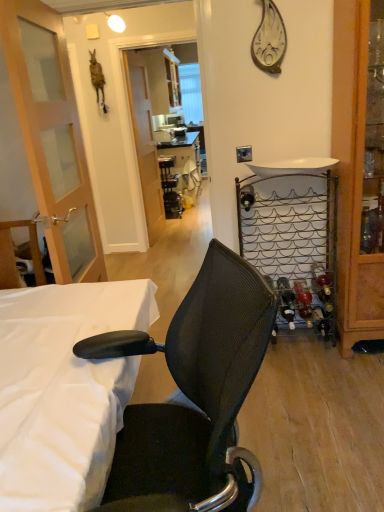
Question: Is point (340, 18) positioned closer to the camera than point (281, 162)?

Choices:
 (A) closer
 (B) farther

Answer: (A)

Question: Which is correct: wooden cabinet at right is inside white glossy sink at upper right, or outside of it?

Choices:
 (A) inside
 (B) outside

Answer: (B)

Question: Based on their relative distances, which object is nearer to the transparent glass screen door at center?

Choices:
 (A) black plastic table at center
 (B) metallic wire wine rack at right, the first bed positioned from the back
 (C) wooden cabinet at right
 (D) metallic leaf-shaped clock at upper right
 (E) black mesh office chair at center

Answer: (A)

Question: Which object is positioned closest to the transparent glass screen door at center?

Choices:
 (A) black plastic table at center
 (B) wooden door at left
 (C) white fabric bed at lower left, the 1th bed when ordered from front to back
 (D) metallic leaf-shaped clock at upper right
 (E) white glossy sink at upper right

Answer: (A)